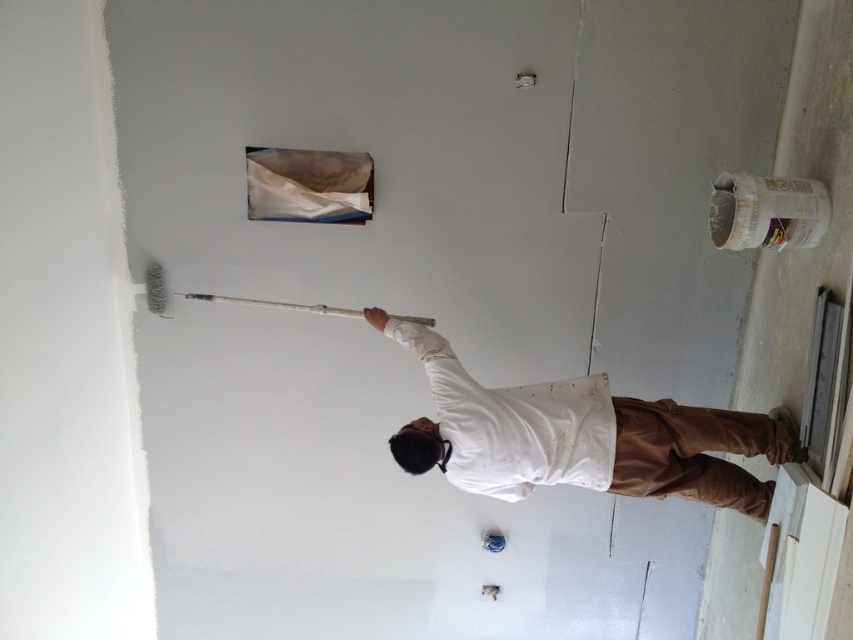
Does white matte shirt at center come in front of white paper at upper center?

That is True.

From the picture: Does white matte shirt at center appear on the right side of white paper at upper center?

Yes, white matte shirt at center is to the right of white paper at upper center.

Is point (640, 433) in front of point (294, 182)?

That is True.

The width and height of the screenshot is (853, 640). I want to click on white matte shirt at center, so click(x=581, y=435).

Which of these two, white matte shirt at center or white synthetic paint roller at upper center, stands shorter?

Standing shorter between the two is white synthetic paint roller at upper center.

Measure the distance from white matte shirt at center to white synthetic paint roller at upper center.

white matte shirt at center is 33.56 inches away from white synthetic paint roller at upper center.

Who is more forward, [761,484] or [148,292]?

Point [761,484]

What are the coordinates of `white matte shirt at center` in the screenshot? It's located at (581, 435).

Does white paper at upper center appear on the left side of white synthetic paint roller at upper center?

In fact, white paper at upper center is to the right of white synthetic paint roller at upper center.

Which of these two, white paper at upper center or white synthetic paint roller at upper center, stands taller?

Standing taller between the two is white paper at upper center.

At what (x,y) coordinates should I click in order to perform the action: click on white paper at upper center. Please return your answer as a coordinate pair (x, y). The width and height of the screenshot is (853, 640). Looking at the image, I should click on (309, 186).